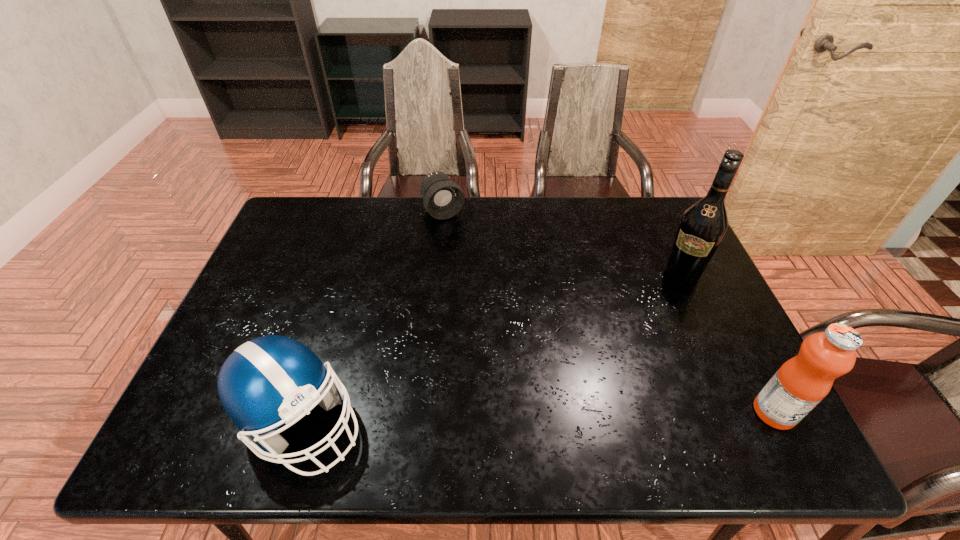
This screenshot has height=540, width=960. Find the location of `object present at the near right corner`. object present at the near right corner is located at coordinates (802, 382).

In the image, there is a desktop. Find the location of `blank space at the far edge`. blank space at the far edge is located at coordinates (339, 207).

Where is `vacant space at the near edge of the desktop`? The width and height of the screenshot is (960, 540). vacant space at the near edge of the desktop is located at coordinates click(x=644, y=387).

You are a GUI agent. You are given a task and a screenshot of the screen. Output one action in this format:
    pyautogui.click(x=<x>, y=<y>)
    Task: Click on the blank space at the left edge
    
    Given the screenshot: What is the action you would take?
    pyautogui.click(x=290, y=244)

In the image, there is a desktop. At what (x,y) coordinates should I click in order to perform the action: click on free space at the far left corner. Please return your answer as a coordinate pair (x, y). Looking at the image, I should click on (276, 238).

The width and height of the screenshot is (960, 540). I want to click on free region at the far right corner, so click(x=664, y=228).

Identify the location of free space at the near right corner of the desktop. The image size is (960, 540). (732, 383).

The height and width of the screenshot is (540, 960). In order to click on vacant area between the third nearest object and the telephoto lens in this screenshot , I will do `click(563, 242)`.

Find the location of a particular element. vacant area that lies between the wine bottle and the telephoto lens is located at coordinates pyautogui.click(x=563, y=242).

Locate an element on the screen. empty space that is in between the shortest object and the third shortest object is located at coordinates (609, 312).